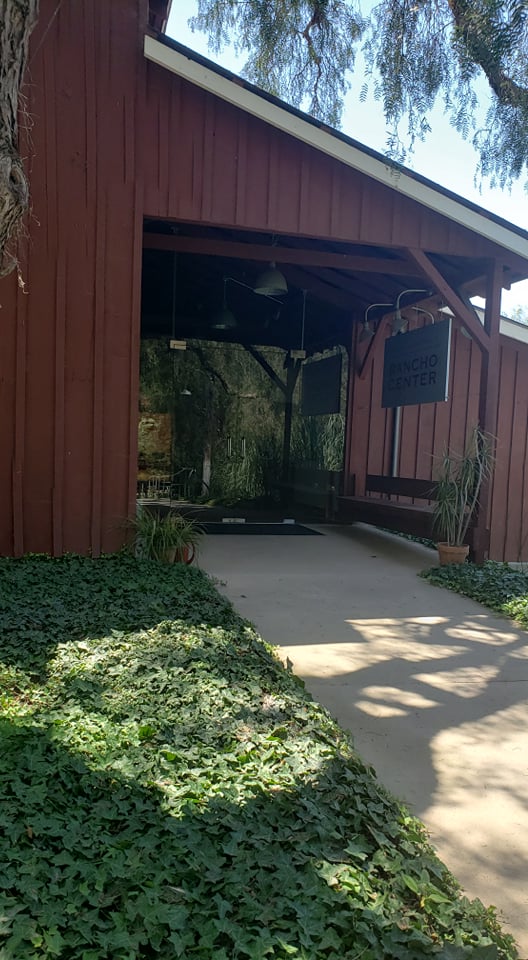
At what (x,y) coordinates should I click in order to perform the action: click on bench. Please return your answer as a coordinate pair (x, y). Looking at the image, I should click on click(x=401, y=509).